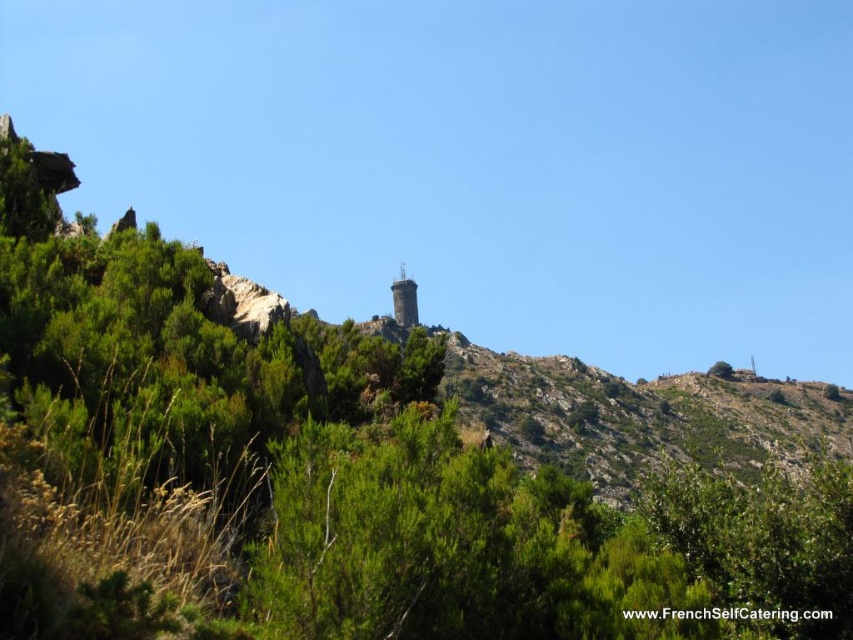
Question: Can you confirm if brown stone tower at center is positioned to the right of green leafy tree at upper right?

Choices:
 (A) no
 (B) yes

Answer: (A)

Question: Which point appears closest to the camera in this image?

Choices:
 (A) (410, 316)
 (B) (730, 369)

Answer: (A)

Question: Is brown stone tower at center closer to the viewer compared to green leafy tree at upper right?

Choices:
 (A) no
 (B) yes

Answer: (B)

Question: Is brown stone tower at center above green leafy tree at upper right?

Choices:
 (A) no
 (B) yes

Answer: (B)

Question: Which of the following is the closest to the observer?

Choices:
 (A) (715, 369)
 (B) (405, 288)

Answer: (B)